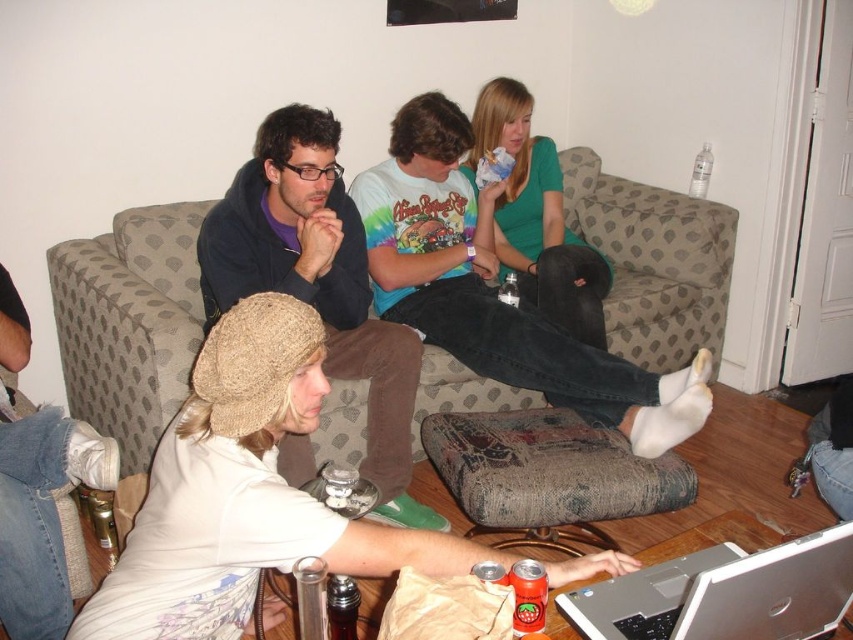
Question: Observing the image, what is the correct spatial positioning of patterned fabric couch at center in reference to green matte shirt at upper center?

Choices:
 (A) right
 (B) left

Answer: (B)

Question: Does patterned fabric couch at center appear under green matte shirt at upper center?

Choices:
 (A) yes
 (B) no

Answer: (A)

Question: Which point is farther to the camera?

Choices:
 (A) green matte shirt at upper center
 (B) matte tie-dye shirt at center
 (C) matte black hoodie at center
 (D) patterned fabric couch at center

Answer: (A)

Question: Among these points, which one is farthest from the camera?

Choices:
 (A) (641, 436)
 (B) (332, 516)

Answer: (A)

Question: Which point is farther from the camera taking this photo?

Choices:
 (A) (616, 344)
 (B) (639, 413)

Answer: (A)

Question: Does white knit hat at center appear on the left side of green matte shirt at upper center?

Choices:
 (A) yes
 (B) no

Answer: (A)